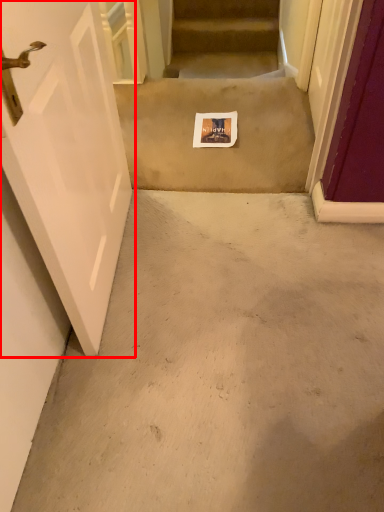
Question: Where is door (annotated by the red box) located in relation to escalator in the image?

Choices:
 (A) right
 (B) left

Answer: (B)